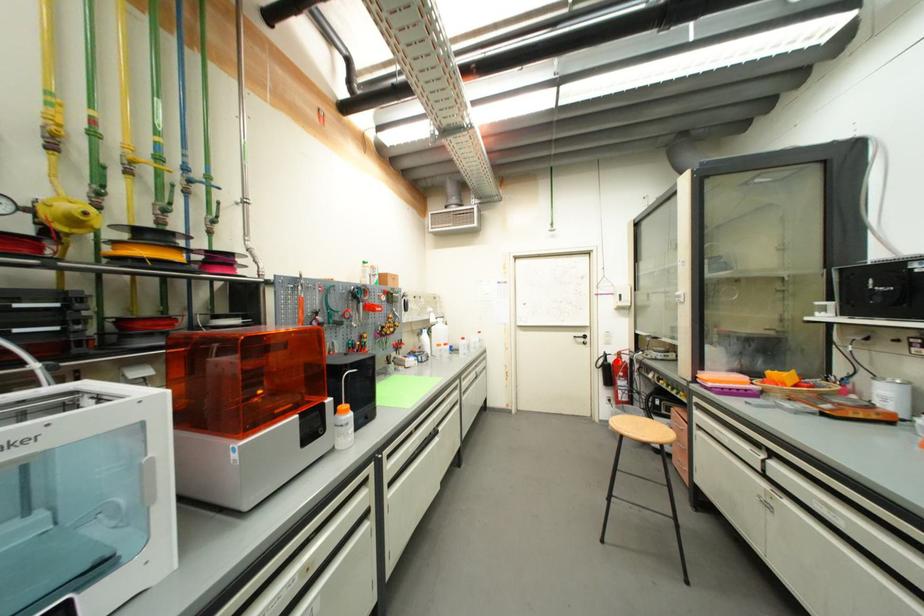
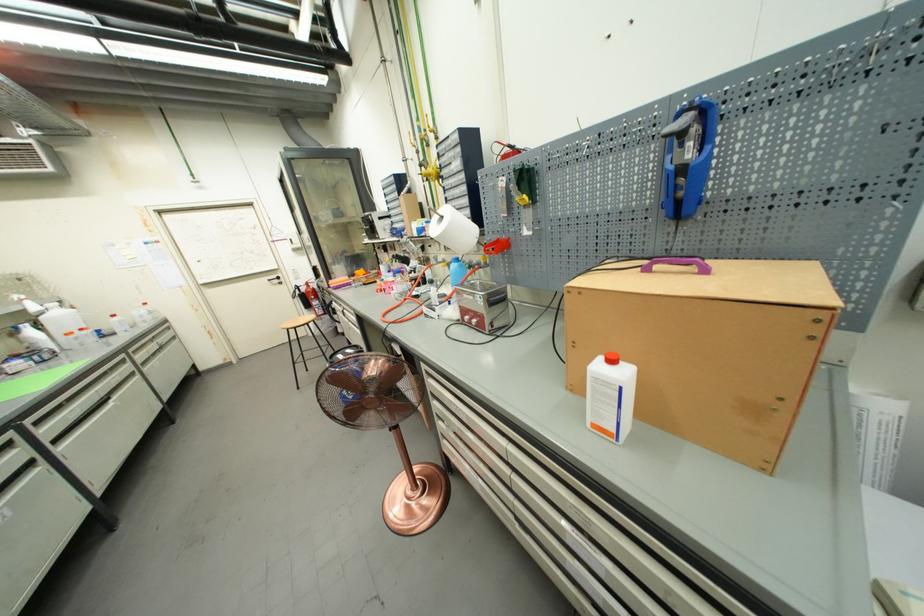
Find the pixel in the second image that matches the highlighted location in the first image.

(309, 291)